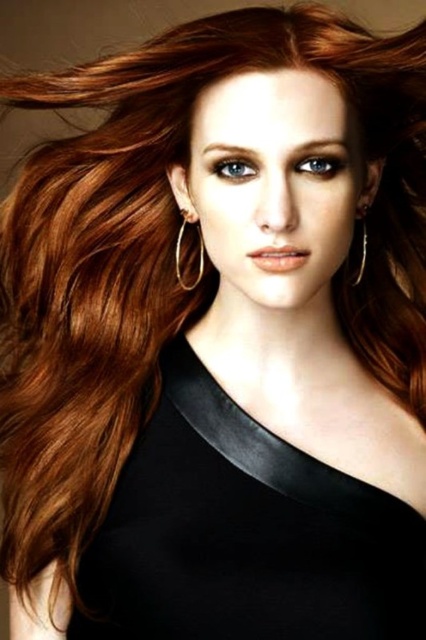
You are a photographer adjusting the focus of your camera. You have two points to focus on in the image, point (x=88, y=568) and point (x=192, y=282). Which point should you focus on to capture the subject in the foreground?

Point (x=88, y=568) is closer to the camera than point (x=192, y=282), so you should focus on point (x=88, y=568) to capture the subject in the foreground.

You are an artist trying to paint the scene. You need to decide which hoop to focus on first based on their positions. Which hoop is positioned closer to you, the silver metallic hoop at center or the gold metallic hoop at upper left?

The silver metallic hoop at center is closer to the viewer than the gold metallic hoop at upper left, so you should focus on the silver metallic hoop at center first.